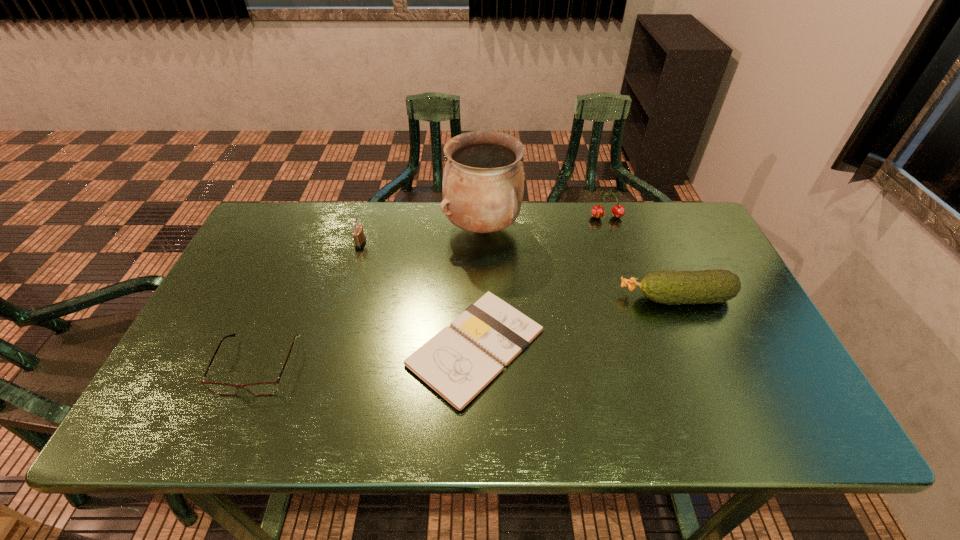
Image resolution: width=960 pixels, height=540 pixels. Identify the location of the tallest object. (483, 185).

The height and width of the screenshot is (540, 960). What are the coordinates of `cherry` in the screenshot? It's located at (618, 211).

The image size is (960, 540). What are the coordinates of `the fifth object from right to left` in the screenshot? It's located at (359, 238).

I want to click on cucumber, so click(668, 287).

Image resolution: width=960 pixels, height=540 pixels. In order to click on the second shortest object in this screenshot , I will do `click(265, 388)`.

Find the location of `spectacles`. spectacles is located at coordinates (265, 388).

Locate an element on the screen. The image size is (960, 540). the shortest object is located at coordinates (458, 367).

Find the location of a particular element. The height and width of the screenshot is (540, 960). vacant region located 0.270m on the right of the tallest object is located at coordinates (607, 228).

In order to click on vacant space located with stems pointing upwards on the cherry in this screenshot , I will do `click(632, 293)`.

Where is `blank space located 0.310m on the front of the fifth object from right to left`? The image size is (960, 540). blank space located 0.310m on the front of the fifth object from right to left is located at coordinates (335, 333).